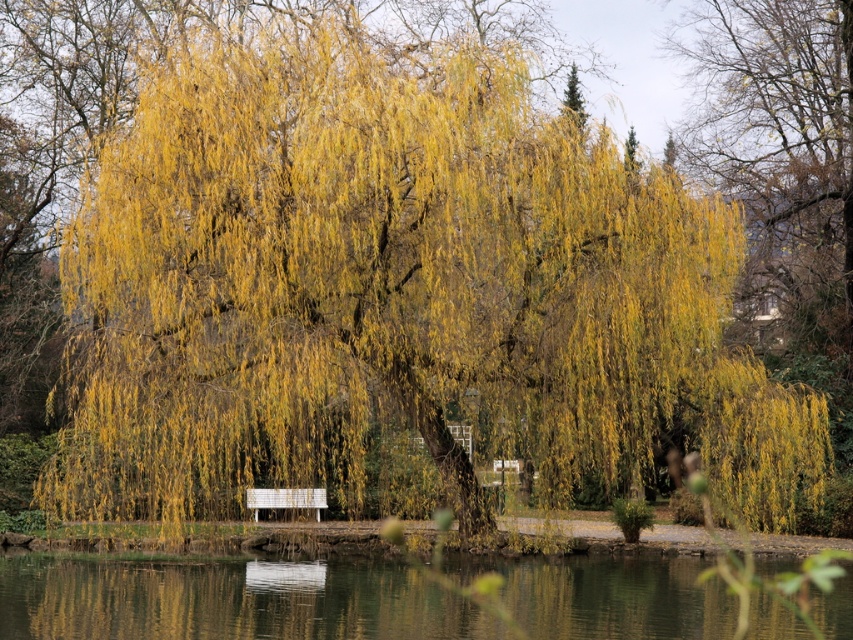
Question: Which point is farther to the camera?

Choices:
 (A) (218, 611)
 (B) (282, 492)

Answer: (B)

Question: Can you confirm if transparent water at lower center is positioned to the left of white wooden bench at center?

Choices:
 (A) no
 (B) yes

Answer: (A)

Question: Where is transparent water at lower center located in relation to white wooden bench at center in the image?

Choices:
 (A) left
 (B) right

Answer: (B)

Question: Does transparent water at lower center have a larger size compared to white wooden bench at center?

Choices:
 (A) yes
 (B) no

Answer: (A)